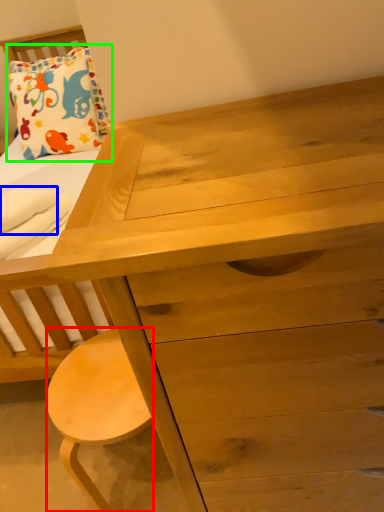
Question: Estimate the real-world distances between objects in this image. Which object is closer to stool (highlighted by a red box), cloth (highlighted by a blue box) or pillow (highlighted by a green box)?

Choices:
 (A) cloth
 (B) pillow

Answer: (A)